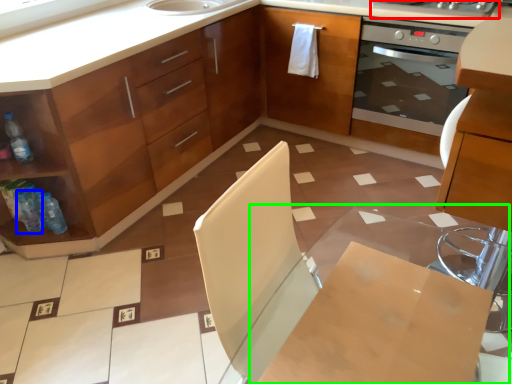
Question: Which object is the closest to the kitchen appliance (highlighted by a red box)? Choose among these: bottle (highlighted by a blue box) or table (highlighted by a green box).

Choices:
 (A) bottle
 (B) table

Answer: (B)